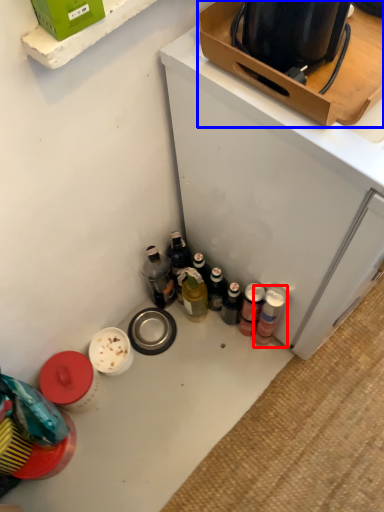
Question: Which point is closer to the camera, bottle (highlighted by a red box) or box (highlighted by a blue box)?

Choices:
 (A) bottle
 (B) box

Answer: (B)